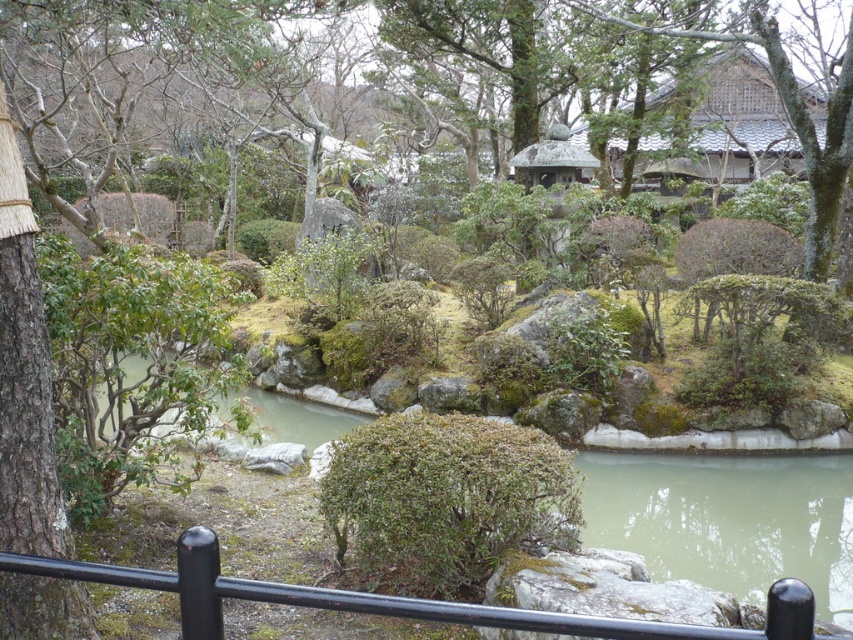
Image resolution: width=853 pixels, height=640 pixels. What do you see at coordinates (440, 500) in the screenshot?
I see `green leafy bush at center` at bounding box center [440, 500].

Between green leafy bush at center and gray tiled roof at upper right, which one has less height?

green leafy bush at center

Who is more forward, (426, 492) or (738, 131)?

Point (426, 492) is more forward.

The width and height of the screenshot is (853, 640). Find the location of `green leafy bush at center`. green leafy bush at center is located at coordinates (440, 500).

Who is more forward, (x=775, y=632) or (x=751, y=88)?

Positioned in front is point (x=775, y=632).

Who is more distant from viewer, (792,616) or (769,81)?

The point (769,81) is behind.

Where is `black metal fence at lower center`? The width and height of the screenshot is (853, 640). black metal fence at lower center is located at coordinates (392, 600).

Find the location of a particular element. Image resolution: width=853 pixels, height=640 pixels. black metal fence at lower center is located at coordinates (392, 600).

Is the position of green leafy bush at center more distant than that of smooth stone gazebo at center?

That is False.

Can you confirm if green leafy bush at center is positioned to the left of smooth stone gazebo at center?

Yes, green leafy bush at center is to the left of smooth stone gazebo at center.

Which is behind, point (331, 454) or point (538, 145)?

Positioned behind is point (538, 145).

What are the coordinates of `green leafy bush at center` in the screenshot? It's located at (440, 500).